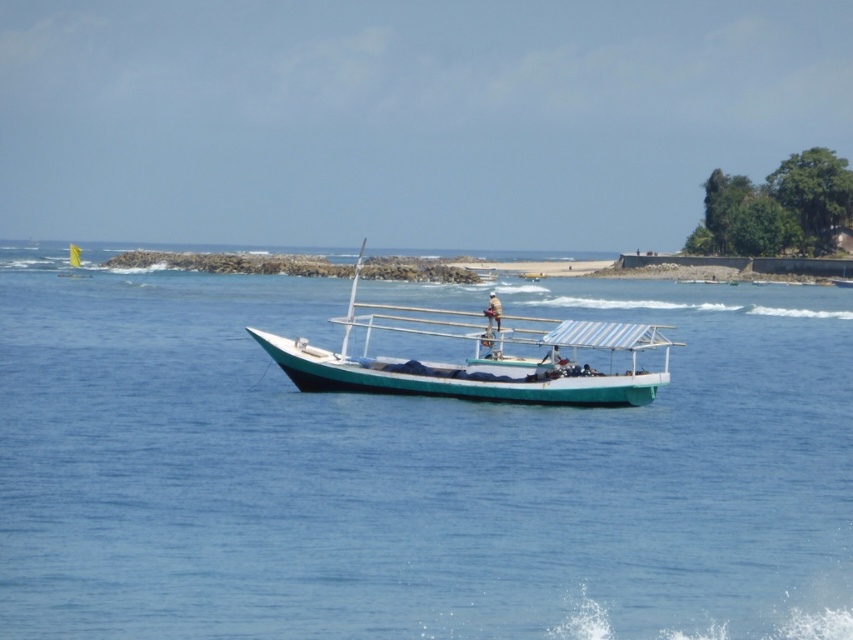
You are a sailor trying to navigate your boat to the jetty. The teal matte boat at center must pass through a narrow channel between two rocks. Given that the blue water at center is wider than the boat, can the boat safely pass through the channel?

The blue water at center has a larger size compared to the teal matte boat at center, so the boat can safely pass through the channel as the water is wider than the boat.